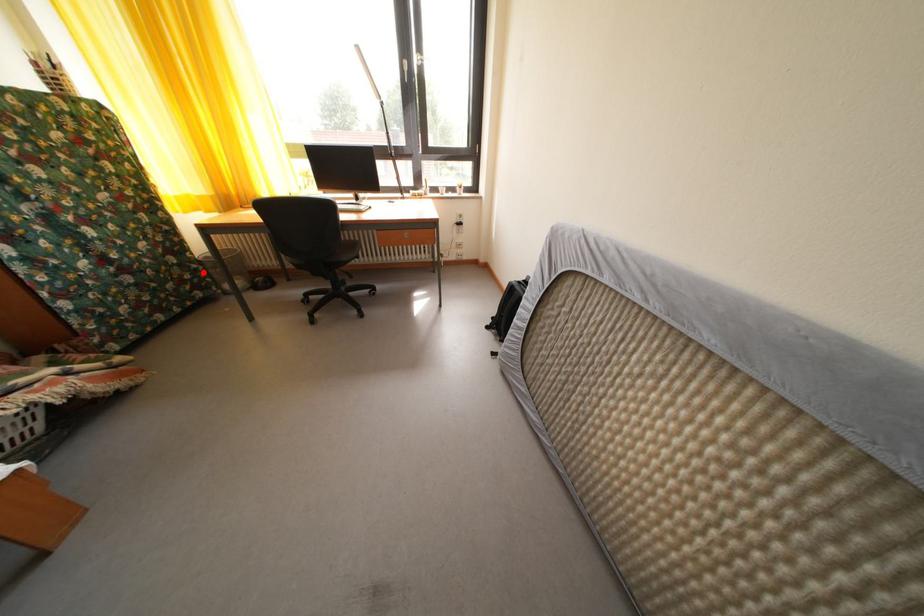
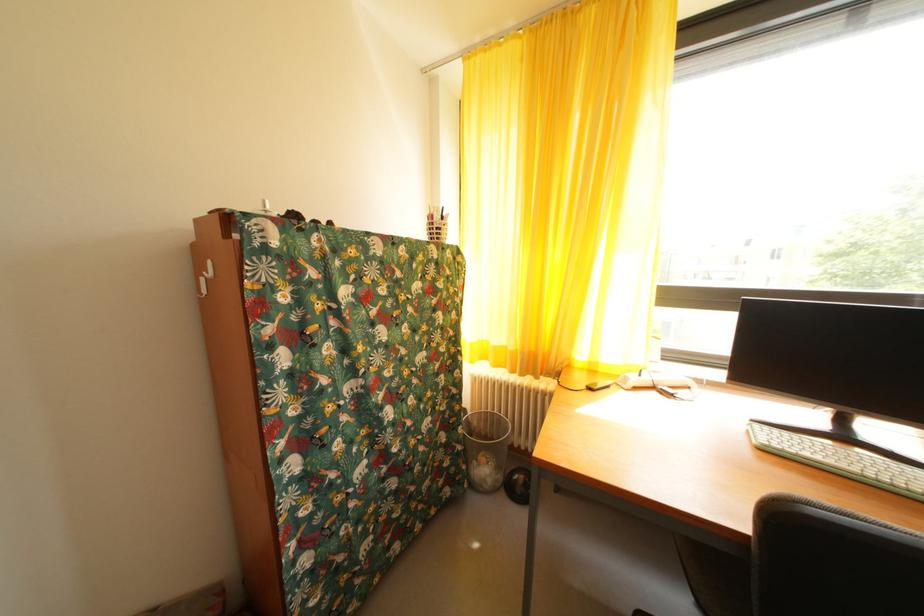
Locate, in the second image, the point that corresponds to the highlighted location in the first image.

(468, 454)